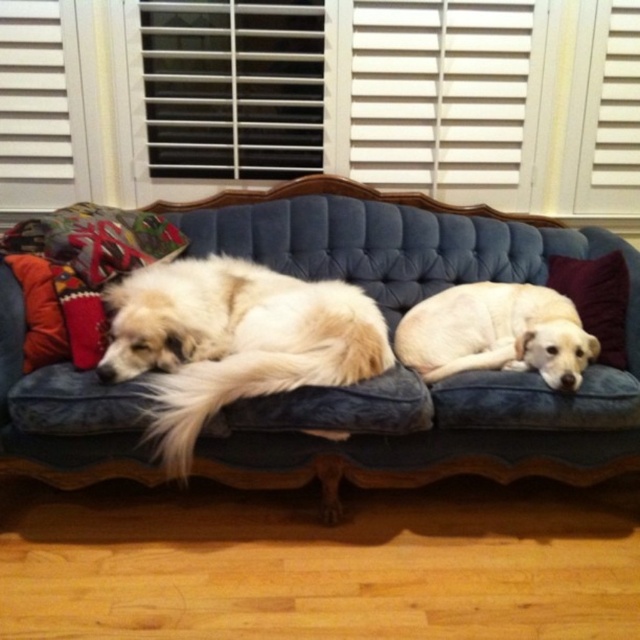
Is white fluffy dog at left bigger than light yellow fur at center?

Correct, white fluffy dog at left is larger in size than light yellow fur at center.

Does white fluffy dog at left come in front of light yellow fur at center?

Yes.

You are a GUI agent. You are given a task and a screenshot of the screen. Output one action in this format:
    pyautogui.click(x=<x>, y=<y>)
    Task: Click on the white fluffy dog at left
    
    Given the screenshot: What is the action you would take?
    pyautogui.click(x=234, y=340)

Can you confirm if light yellow fur at center is shorter than purple velvet pillow at right?

Indeed, light yellow fur at center has a lesser height compared to purple velvet pillow at right.

Is point (484, 314) positioned after point (618, 353)?

Yes, it is.

Image resolution: width=640 pixels, height=640 pixels. Find the location of `light yellow fur at center`. light yellow fur at center is located at coordinates (497, 333).

Is velvet blue couch at center to the left of purple velvet pillow at right from the viewer's perspective?

Yes, velvet blue couch at center is to the left of purple velvet pillow at right.

In the scene shown: Can you confirm if velvet blue couch at center is bigger than purple velvet pillow at right?

Yes.

At what (x,y) coordinates should I click in order to perform the action: click on velvet blue couch at center. Please return your answer as a coordinate pair (x, y). The image size is (640, 640). Looking at the image, I should click on (392, 241).